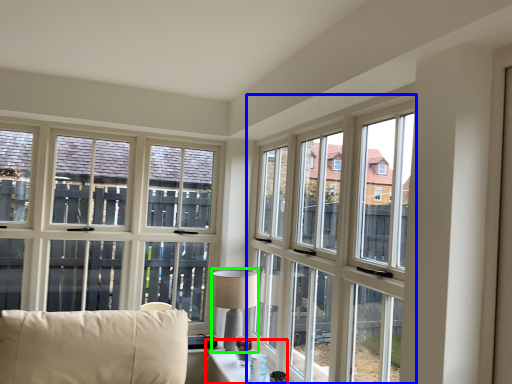
Question: Estimate the real-world distances between objects in this image. Which object is closer to table (highlighted by a red box), window (highlighted by a blue box) or table lamp (highlighted by a green box)?

Choices:
 (A) window
 (B) table lamp

Answer: (B)